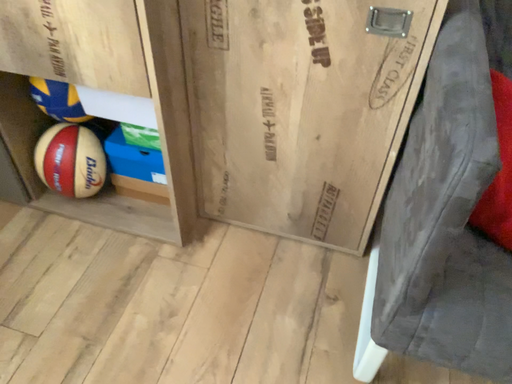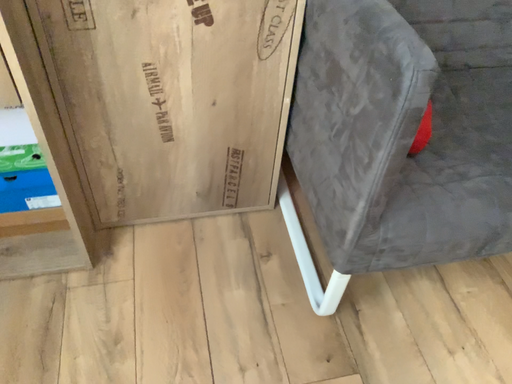
Question: Which way did the camera rotate in the video?

Choices:
 (A) rotated right
 (B) rotated left

Answer: (A)